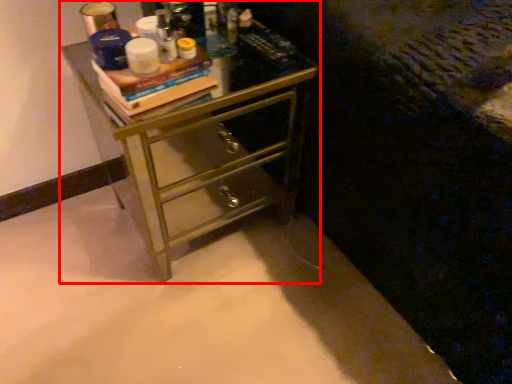
Question: From the image, what is the correct spatial relationship of chest of drawers (annotated by the red box) in relation to book?

Choices:
 (A) right
 (B) left

Answer: (A)